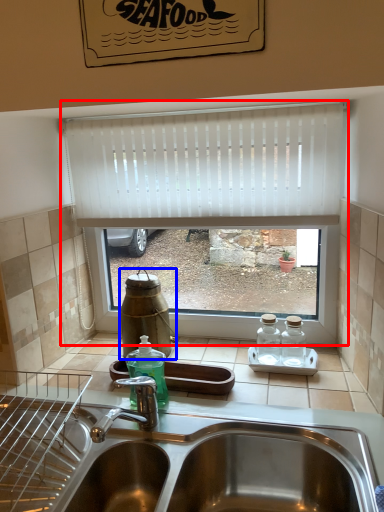
Question: Which object appears closest to the camera in this image, window (highlighted by a red box) or bottle (highlighted by a blue box)?

Choices:
 (A) window
 (B) bottle

Answer: (A)